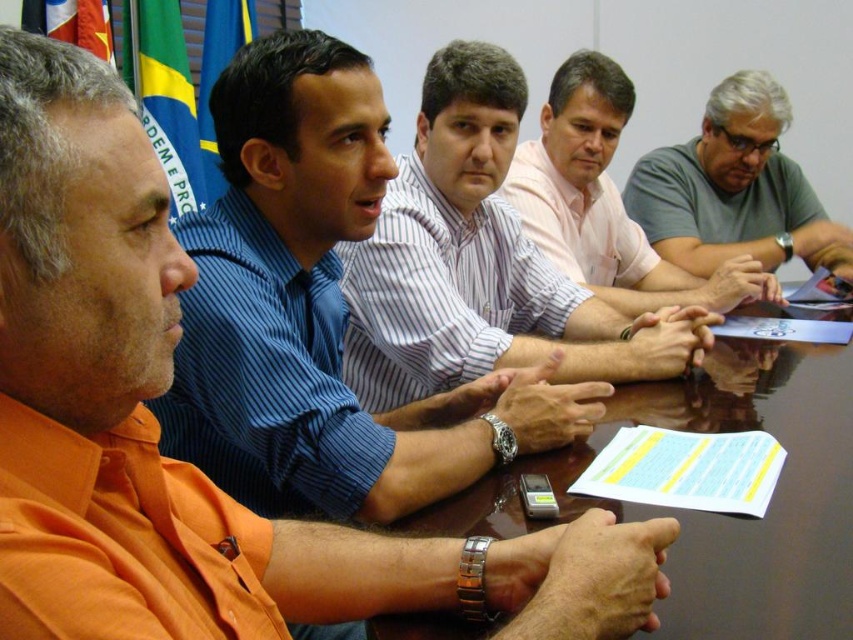
Between white striped shirt at center and gray cotton shirt at center, which one is positioned higher?

gray cotton shirt at center is higher up.

Is white striped shirt at center further to camera compared to gray cotton shirt at center?

No, it is in front of gray cotton shirt at center.

Does point (474, 189) lie behind point (534, 177)?

That is False.

Where is `white striped shirt at center`? This screenshot has height=640, width=853. white striped shirt at center is located at coordinates (474, 260).

Who is positioned more to the left, white striped shirt at center or glossy wooden table at center?

Positioned to the left is white striped shirt at center.

Describe the element at coordinates (474, 260) in the screenshot. Image resolution: width=853 pixels, height=640 pixels. I see `white striped shirt at center` at that location.

Identify the location of white striped shirt at center. This screenshot has height=640, width=853. (474, 260).

Is white striped shirt at center positioned in front of gray matte shirt at upper right?

Yes, white striped shirt at center is in front of gray matte shirt at upper right.

Between point (358, 244) and point (813, 211), which one is positioned behind?

Positioned behind is point (813, 211).

At what (x,y) coordinates should I click in order to perform the action: click on white striped shirt at center. Please return your answer as a coordinate pair (x, y). This screenshot has width=853, height=640. Looking at the image, I should click on (474, 260).